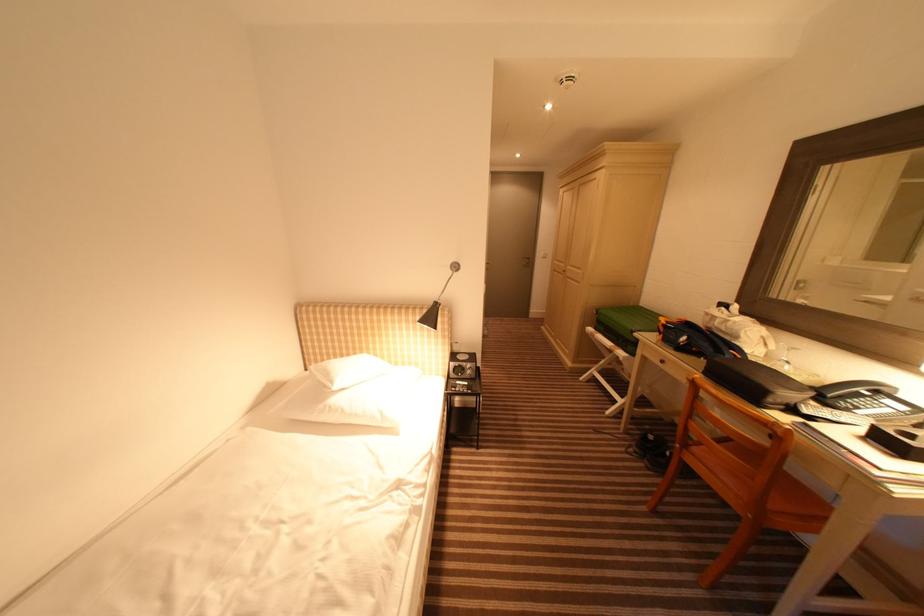
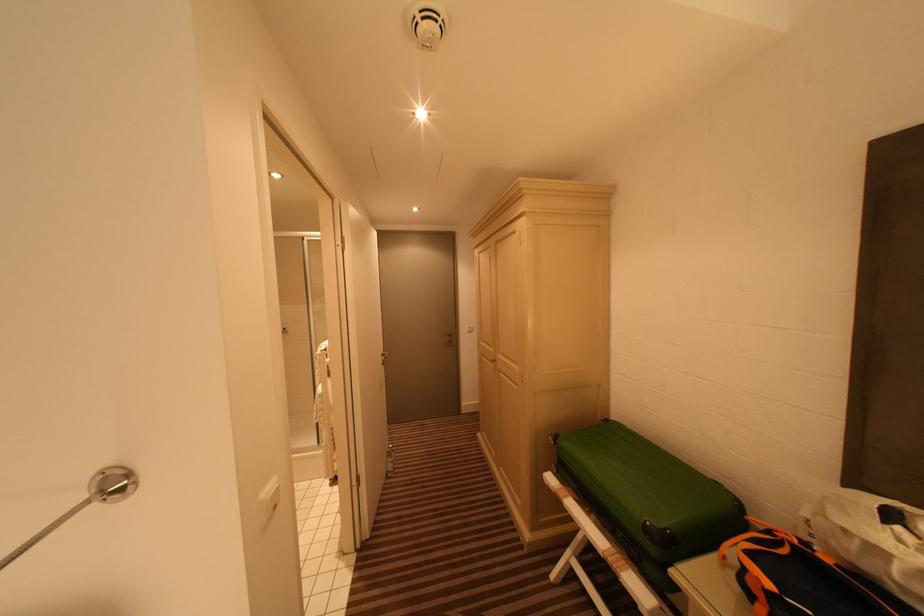
In the second image, find the point that corresponds to point 463,270 in the first image.

(120, 488)